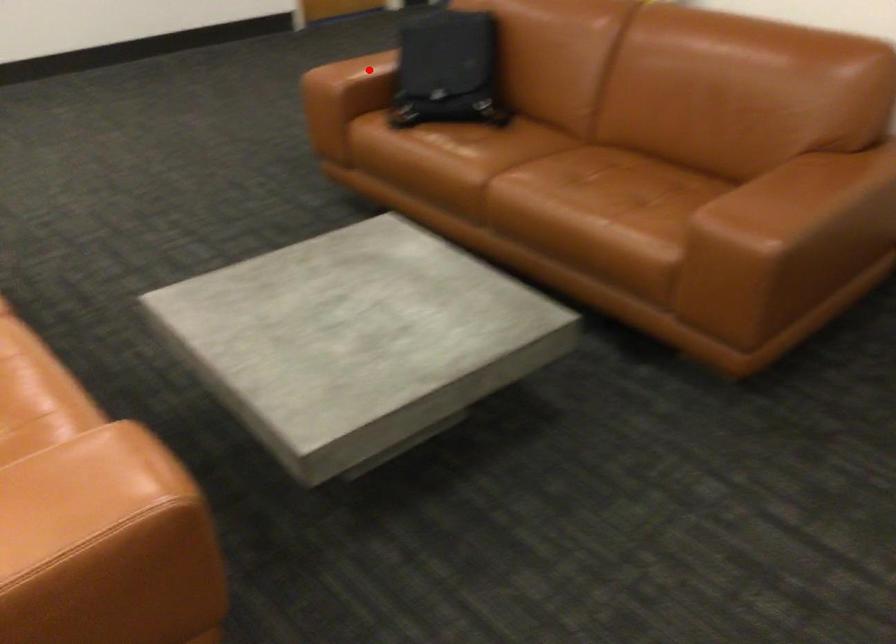
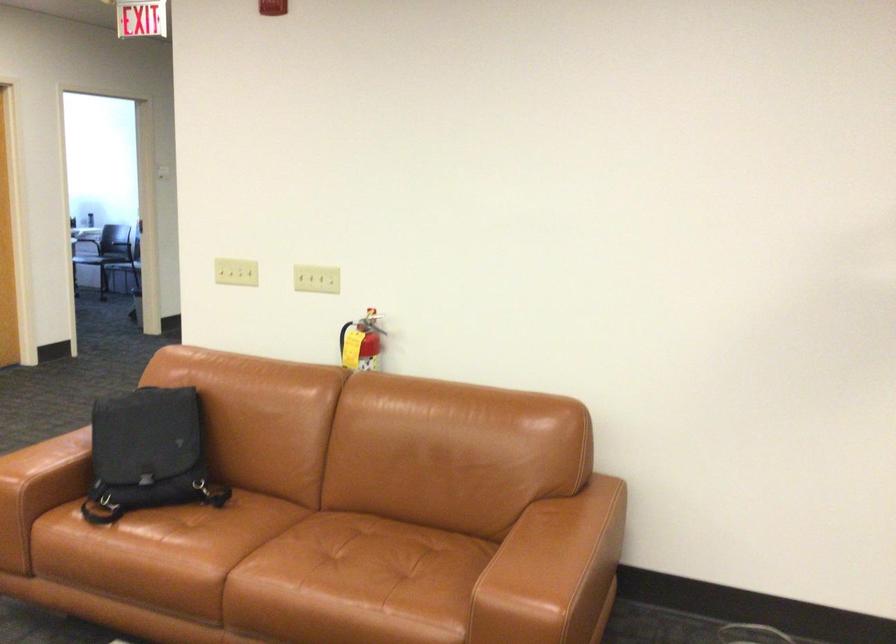
Question: I am providing you with two images of the same scene from different viewpoints. Image1 has a red point marked. In image2, the corresponding 3D location appears at what relative position? Reply with the corresponding letter.

Choices:
 (A) Closer
 (B) Farther

Answer: (A)